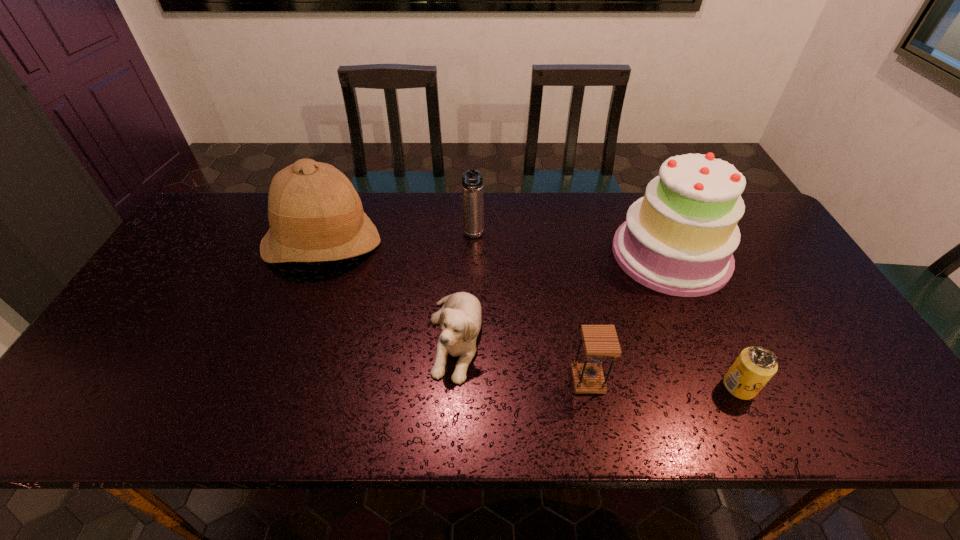
This screenshot has height=540, width=960. I want to click on cake, so click(679, 239).

You are a GUI agent. You are given a task and a screenshot of the screen. Output one action in this format:
    pyautogui.click(x=<x>, y=<y>)
    Task: Click on the leftmost object
    The image size is (960, 540).
    Given the screenshot: What is the action you would take?
    pyautogui.click(x=315, y=214)

Find the location of a particular element. The width and height of the screenshot is (960, 540). the fourth shortest object is located at coordinates (472, 180).

Where is `the fourth object from left to right`? the fourth object from left to right is located at coordinates 600,341.

This screenshot has height=540, width=960. I want to click on puppy, so click(460, 319).

Identify the location of beer can. (755, 366).

You are a GUI agent. You are given a task and a screenshot of the screen. Output one action in this format:
    pyautogui.click(x=<x>, y=<y>)
    Task: Click on the vacant space located on the left of the cake
    The height and width of the screenshot is (540, 960).
    Given the screenshot: What is the action you would take?
    pyautogui.click(x=499, y=254)

Where is `vacant area situated on the front-facing side of the hat`? The image size is (960, 540). vacant area situated on the front-facing side of the hat is located at coordinates (275, 371).

Locate an element on the screen. free space located on the handle side of the third tallest object is located at coordinates point(472,262).

Where is `free location located 0.120m on the right of the fourth object from left to right`? The height and width of the screenshot is (540, 960). free location located 0.120m on the right of the fourth object from left to right is located at coordinates (655, 380).